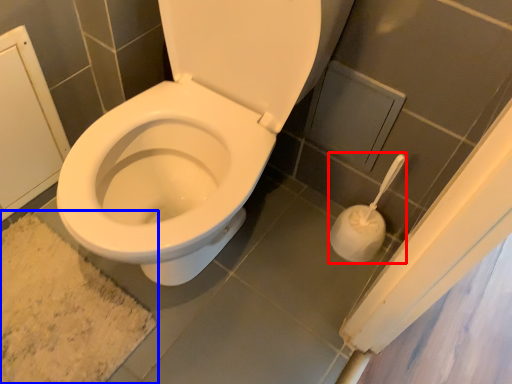
Question: Which object appears closest to the camera in this image, toilet paper (highlighted by a red box) or bath mat (highlighted by a blue box)?

Choices:
 (A) toilet paper
 (B) bath mat

Answer: (A)